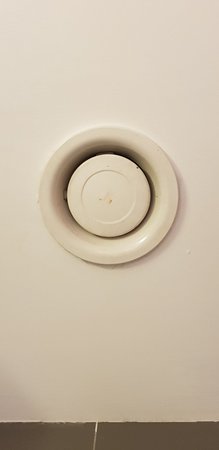
I want to click on tan paint, so click(x=122, y=354), click(x=114, y=240), click(x=110, y=212), click(x=137, y=45).